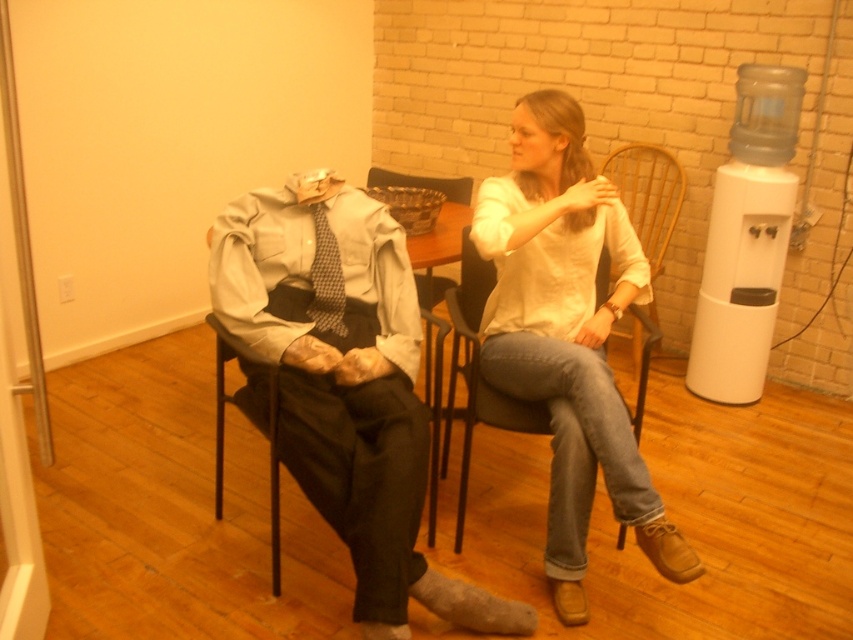
Question: Is white cotton shirt at center above black plastic chair at center?

Choices:
 (A) yes
 (B) no

Answer: (B)

Question: Which point is closer to the camera?

Choices:
 (A) (628, 410)
 (B) (343, 324)

Answer: (A)

Question: Can you confirm if black plastic chair at center is positioned to the right of checkered fabric tie at center?

Choices:
 (A) no
 (B) yes

Answer: (B)

Question: Considering the relative positions of white cotton shirt at center and black plastic chair at center in the image provided, where is white cotton shirt at center located with respect to black plastic chair at center?

Choices:
 (A) below
 (B) above

Answer: (A)

Question: Which of the following is the farthest from the observer?

Choices:
 (A) white cotton shirt at center
 (B) black plastic chair at center

Answer: (B)

Question: Which point is closer to the camera taking this photo?

Choices:
 (A) (343, 433)
 (B) (479, 340)

Answer: (A)